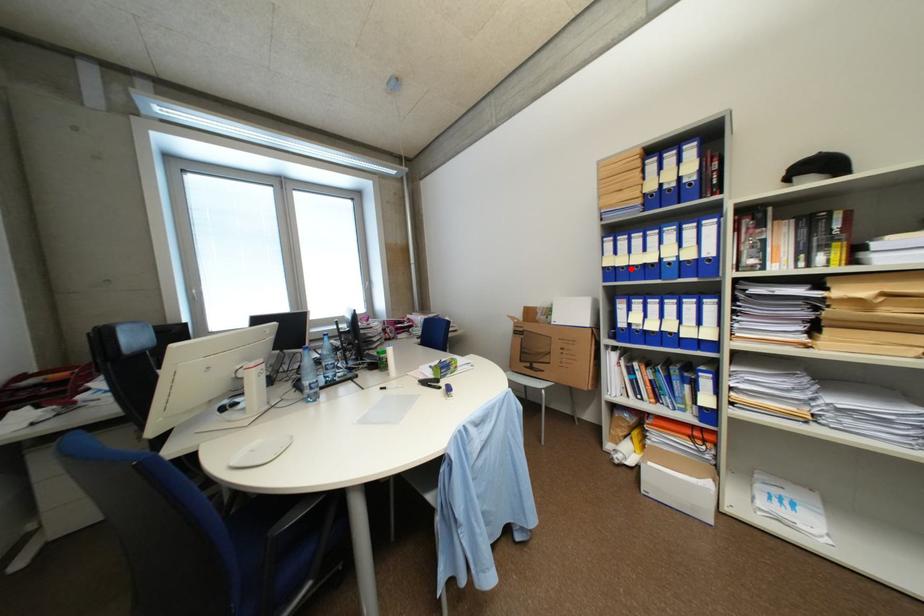
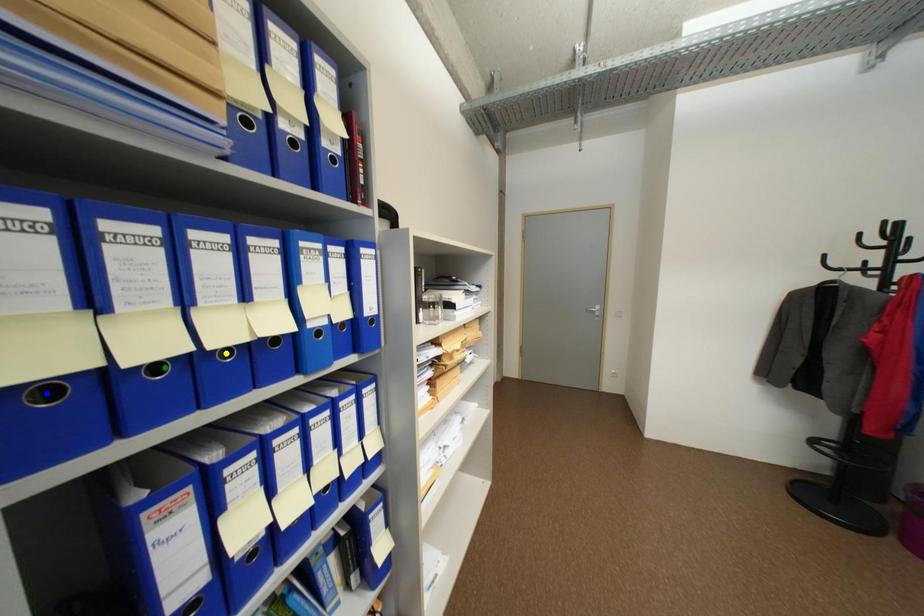
Question: I am providing you with two images of the same scene from different viewpoints. A red point is marked on the first image. You are given multiple points on the second image. Can you choose the point in image 2 that corresponds to the point in image 1?

Choices:
 (A) blue point
 (B) yellow point
 (C) green point

Answer: (C)